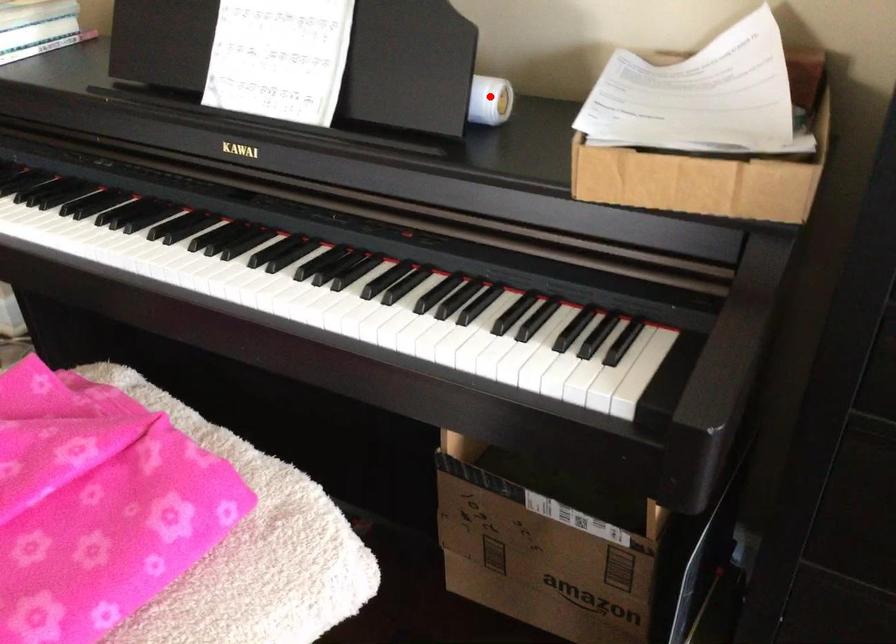
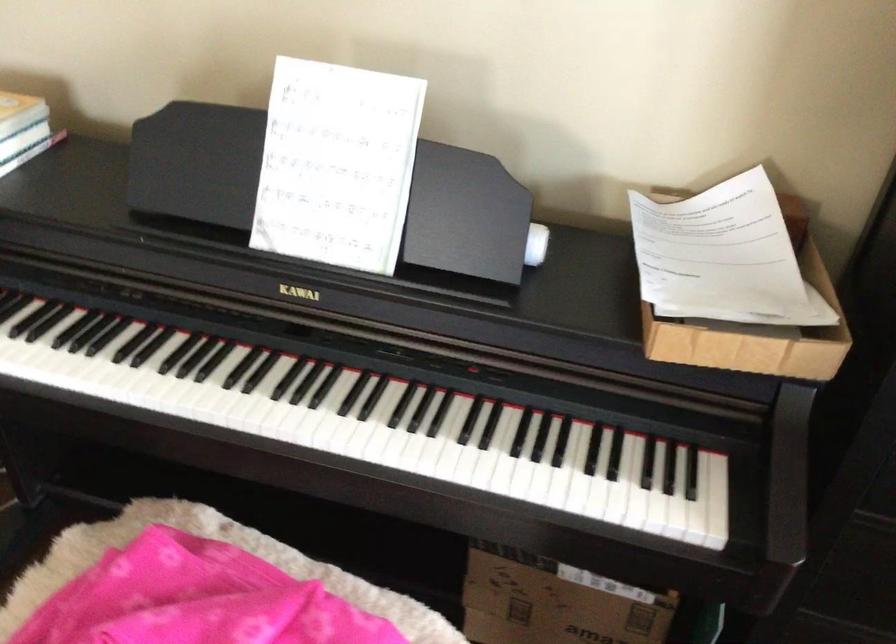
Find the pixel in the second image that matches the highlighted location in the first image.

(536, 243)